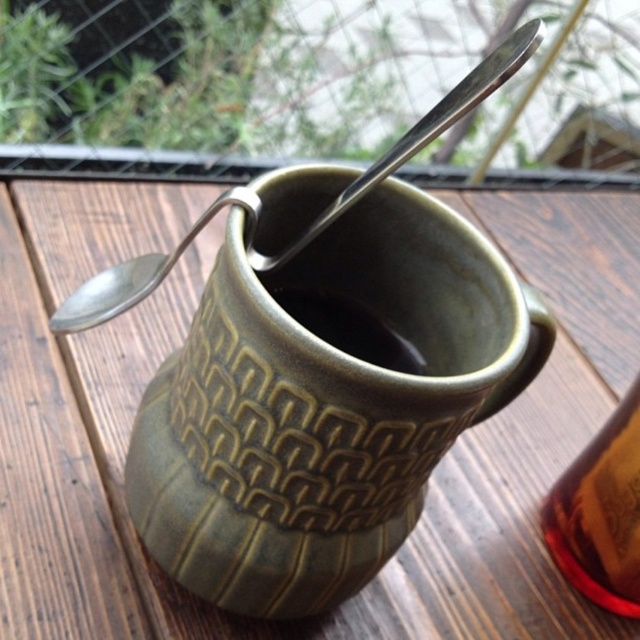
Which is more to the left, translucent amber liquid at upper right or satin silver spoon at left?

From the viewer's perspective, satin silver spoon at left appears more on the left side.

Describe the element at coordinates (602, 513) in the screenshot. This screenshot has height=640, width=640. I see `translucent amber liquid at upper right` at that location.

Which is in front, point (632, 508) or point (248, 241)?

Point (248, 241) is in front.

This screenshot has width=640, height=640. In order to click on translucent amber liquid at upper right in this screenshot , I will do `click(602, 513)`.

Between green textured mug at center and translucent amber liquid at upper right, which one has less height?

Standing shorter between the two is translucent amber liquid at upper right.

Can you confirm if green textured mug at center is bigger than translucent amber liquid at upper right?

Yes, green textured mug at center is bigger than translucent amber liquid at upper right.

Does point (289, 518) lie in front of point (630, 424)?

Yes, point (289, 518) is in front of point (630, 424).

Identify the location of green textured mug at center. (324, 404).

Does green textured mug at center appear on the left side of satin silver spoon at left?

In fact, green textured mug at center is to the right of satin silver spoon at left.

Which is more to the left, green textured mug at center or satin silver spoon at left?

satin silver spoon at left is more to the left.

Find the location of a particular element. The image size is (640, 640). green textured mug at center is located at coordinates (324, 404).

Where is `green textured mug at center`? green textured mug at center is located at coordinates (324, 404).